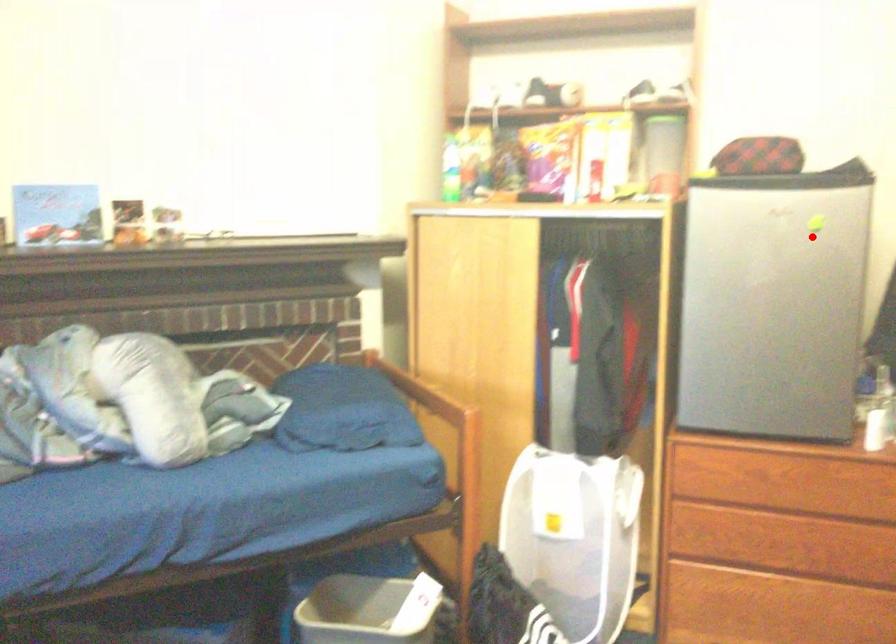
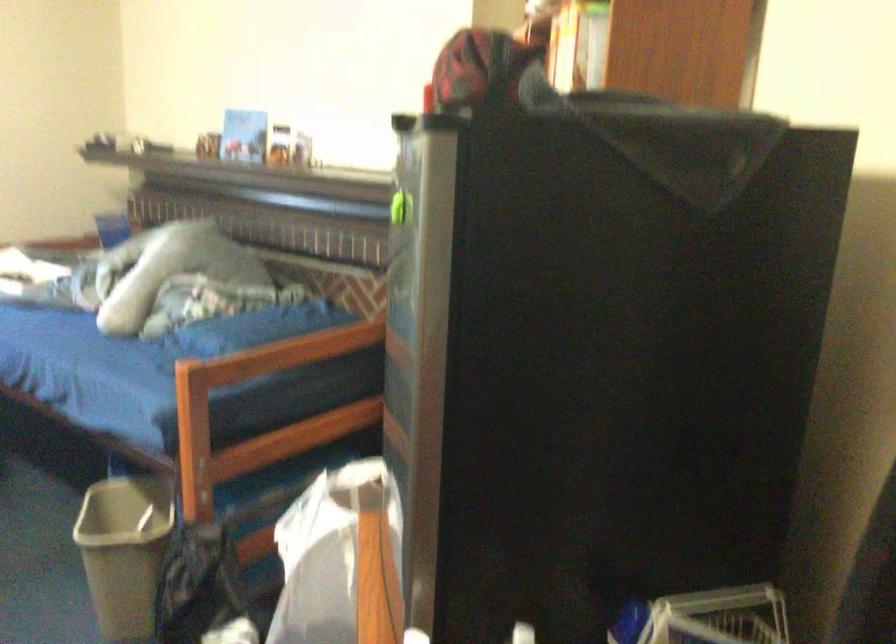
Question: I am providing you with two images of the same scene from different viewpoints. A red point is marked on the first image. Can you still see the location of the red point in image 2?

Choices:
 (A) Yes
 (B) No

Answer: (A)